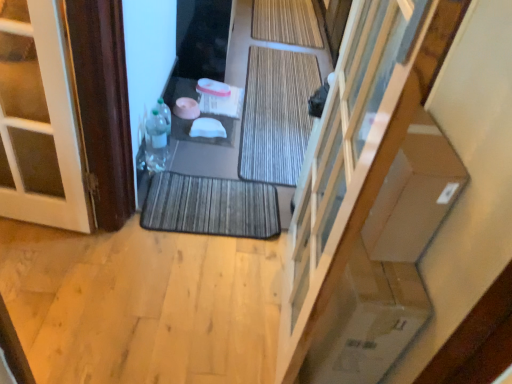
The width and height of the screenshot is (512, 384). What do you see at coordinates (286, 22) in the screenshot?
I see `natural bamboo bath mat at center, marked as the 3th bath mat in a bottom-to-top arrangement` at bounding box center [286, 22].

Locate an element on the screen. The width and height of the screenshot is (512, 384). dark gray textured bath mat at center, which is the 3th bath mat in top-to-bottom order is located at coordinates (211, 206).

Measure the distance between brown textured bath mat at center, marked as the second bath mat in a top-to-bottom arrangement, and camera.

brown textured bath mat at center, marked as the second bath mat in a top-to-bottom arrangement, and camera are 7.17 feet apart.

How much space does brown textured bath mat at center, placed as the second bath mat when sorted from front to back, occupy vertically?

The height of brown textured bath mat at center, placed as the second bath mat when sorted from front to back, is 2.13 centimeters.

The image size is (512, 384). Describe the element at coordinates (164, 114) in the screenshot. I see `translucent plastic bottle at lower left, marked as the first bottle in a top-to-bottom arrangement` at that location.

At what (x,y) coordinates should I click in order to perform the action: click on natural bamboo bath mat at center, which is the 1th bath mat from back to front. Please return your answer as a coordinate pair (x, y). This screenshot has height=384, width=512. Looking at the image, I should click on (286, 22).

Is point (261, 197) closer to viewer compared to point (264, 84)?

Yes, it is in front of point (264, 84).

Identify the location of bath mat that is the 1st object above the dark gray textured bath mat at center, which ranks as the first bath mat in front-to-back order (from a real-world perspective). (276, 115).

Can you tell me how much dark gray textured bath mat at center, which ranks as the first bath mat in front-to-back order, and brown textured bath mat at center, placed as the second bath mat when sorted from front to back, differ in facing direction?

The facing directions of dark gray textured bath mat at center, which ranks as the first bath mat in front-to-back order, and brown textured bath mat at center, placed as the second bath mat when sorted from front to back, are 2.99 degrees apart.

Looking at this image, from a real-world perspective, is dark gray textured bath mat at center, which is counted as the third bath mat, starting from the back, positioned under translucent plastic bottle at lower left, marked as the first bottle in a top-to-bottom arrangement, based on gravity?

→ Correct, in the physical world, dark gray textured bath mat at center, which is counted as the third bath mat, starting from the back, is lower than translucent plastic bottle at lower left, marked as the first bottle in a top-to-bottom arrangement.

Is dark gray textured bath mat at center, which ranks as the first bath mat in front-to-back order, in front of translucent plastic bottle at lower left, marked as the first bottle in a top-to-bottom arrangement?

Yes, it is in front of translucent plastic bottle at lower left, marked as the first bottle in a top-to-bottom arrangement.

From the picture: Is dark gray textured bath mat at center, which is counted as the third bath mat, starting from the back, thinner than translucent plastic bottle at lower left, acting as the 2th bottle starting from the bottom?

Result: No.

Is dark gray textured bath mat at center, which is the 3th bath mat in top-to-bottom order, bigger or smaller than translucent plastic bottle at lower left, acting as the 2th bottle starting from the bottom?

In the image, dark gray textured bath mat at center, which is the 3th bath mat in top-to-bottom order, appears to be larger than translucent plastic bottle at lower left, acting as the 2th bottle starting from the bottom.

Identify the location of door located behind the transparent glass door at center. This screenshot has height=384, width=512. (39, 120).

From a real-world perspective, is brown wood door at left positioned above or below transparent glass door at center?

Clearly, from a real-world perspective, brown wood door at left is below transparent glass door at center.

Looking at this image, could you tell me if brown wood door at left is turned towards transparent glass door at center?

No, brown wood door at left is not aimed at transparent glass door at center.

Considering the positions of objects natural bamboo bath mat at center, which is the 1th bath mat from back to front, and brown textured bath mat at center, marked as the second bath mat in a top-to-bottom arrangement, in the image provided, who is more to the right, natural bamboo bath mat at center, which is the 1th bath mat from back to front, or brown textured bath mat at center, marked as the second bath mat in a top-to-bottom arrangement,?

Positioned to the right is natural bamboo bath mat at center, which is the 1th bath mat from back to front.

From a real-world perspective, is natural bamboo bath mat at center, marked as the 3th bath mat in a bottom-to-top arrangement, positioned above or below brown textured bath mat at center, the 2th bath mat viewed from the back?

natural bamboo bath mat at center, marked as the 3th bath mat in a bottom-to-top arrangement, is situated higher than brown textured bath mat at center, the 2th bath mat viewed from the back, in the real world.

Is natural bamboo bath mat at center, placed as the third bath mat when sorted from front to back, facing away from brown textured bath mat at center, the 2th bath mat viewed from the back?

No.

Is natural bamboo bath mat at center, marked as the 3th bath mat in a bottom-to-top arrangement, in contact with brown textured bath mat at center, the 2th bath mat ordered from the bottom?

natural bamboo bath mat at center, marked as the 3th bath mat in a bottom-to-top arrangement, is not next to brown textured bath mat at center, the 2th bath mat ordered from the bottom, and they're not touching.

Who is shorter, translucent plastic bottle at left, which is counted as the second bottle, starting from the top, or brown textured bath mat at center, marked as the second bath mat in a top-to-bottom arrangement?

brown textured bath mat at center, marked as the second bath mat in a top-to-bottom arrangement, is shorter.

Is translucent plastic bottle at left, which is the 1th bottle from bottom to top, aimed at brown textured bath mat at center, the 2th bath mat ordered from the bottom?

No, translucent plastic bottle at left, which is the 1th bottle from bottom to top, is not aimed at brown textured bath mat at center, the 2th bath mat ordered from the bottom.

Does translucent plastic bottle at left, which is counted as the second bottle, starting from the top, have a greater width compared to brown textured bath mat at center, the 2th bath mat viewed from the back?

No, translucent plastic bottle at left, which is counted as the second bottle, starting from the top, is not wider than brown textured bath mat at center, the 2th bath mat viewed from the back.

Is translucent plastic bottle at left, which is the 1th bottle from bottom to top, positioned in front of brown textured bath mat at center, placed as the second bath mat when sorted from front to back?

Yes, translucent plastic bottle at left, which is the 1th bottle from bottom to top, is in front of brown textured bath mat at center, placed as the second bath mat when sorted from front to back.

From a real-world perspective, between translucent plastic bottle at lower left, marked as the first bottle in a top-to-bottom arrangement, and brown wood door at left, who is vertically lower?

translucent plastic bottle at lower left, marked as the first bottle in a top-to-bottom arrangement, from a real-world perspective.

How many degrees apart are the facing directions of translucent plastic bottle at lower left, marked as the first bottle in a top-to-bottom arrangement, and brown wood door at left?

They differ by 176 degrees in their facing directions.

Is translucent plastic bottle at lower left, marked as the first bottle in a top-to-bottom arrangement, facing towards brown wood door at left?

No, translucent plastic bottle at lower left, marked as the first bottle in a top-to-bottom arrangement, is not oriented towards brown wood door at left.

Looking at this image, in terms of width, does translucent plastic bottle at lower left, marked as the first bottle in a top-to-bottom arrangement, look wider or thinner when compared to brown wood door at left?

translucent plastic bottle at lower left, marked as the first bottle in a top-to-bottom arrangement, is thinner than brown wood door at left.

From a real-world perspective, is translucent plastic bottle at lower left, marked as the first bottle in a top-to-bottom arrangement, on dark gray textured bath mat at center, which is counted as the third bath mat, starting from the back?

Yes, from a real-world perspective, translucent plastic bottle at lower left, marked as the first bottle in a top-to-bottom arrangement, is above dark gray textured bath mat at center, which is counted as the third bath mat, starting from the back.

Is dark gray textured bath mat at center, which is the 3th bath mat in top-to-bottom order, located within translucent plastic bottle at lower left, marked as the first bottle in a top-to-bottom arrangement?

That's incorrect, dark gray textured bath mat at center, which is the 3th bath mat in top-to-bottom order, is not inside translucent plastic bottle at lower left, marked as the first bottle in a top-to-bottom arrangement.

Is point (168, 136) closer or farther from the camera than point (212, 205)?

Point (168, 136) is positioned farther from the camera compared to point (212, 205).

Between translucent plastic bottle at lower left, acting as the 2th bottle starting from the bottom, and dark gray textured bath mat at center, which appears as the first bath mat when ordered from the bottom, which one has more height?

translucent plastic bottle at lower left, acting as the 2th bottle starting from the bottom, is taller.

The image size is (512, 384). In order to click on bath mat lying in front of the brown textured bath mat at center, the 2th bath mat ordered from the bottom in this screenshot , I will do `click(211, 206)`.

Locate an element on the screen. The width and height of the screenshot is (512, 384). the 2nd bottle positioned above the dark gray textured bath mat at center, which is the 3th bath mat in top-to-bottom order (from a real-world perspective) is located at coordinates (164, 114).

Based on their spatial positions, is brown wood door at left or natural bamboo bath mat at center, placed as the third bath mat when sorted from front to back, further from dark gray textured bath mat at center, which is the 3th bath mat in top-to-bottom order?

Among the two, natural bamboo bath mat at center, placed as the third bath mat when sorted from front to back, is located further to dark gray textured bath mat at center, which is the 3th bath mat in top-to-bottom order.

Which object lies further to the anchor point natural bamboo bath mat at center, marked as the 3th bath mat in a bottom-to-top arrangement, brown wood door at left or transparent glass door at center?

The object further to natural bamboo bath mat at center, marked as the 3th bath mat in a bottom-to-top arrangement, is transparent glass door at center.

Which object lies nearer to the anchor point natural bamboo bath mat at center, the first bath mat in the top-to-bottom sequence, transparent glass door at center or translucent plastic bottle at left, which is counted as the second bottle, starting from the top?

translucent plastic bottle at left, which is counted as the second bottle, starting from the top, is closer to natural bamboo bath mat at center, the first bath mat in the top-to-bottom sequence.

When comparing their distances from brown wood door at left, does natural bamboo bath mat at center, the first bath mat in the top-to-bottom sequence, or translucent plastic bottle at lower left, marked as the first bottle in a top-to-bottom arrangement, seem closer?

translucent plastic bottle at lower left, marked as the first bottle in a top-to-bottom arrangement, lies closer to brown wood door at left than the other object.

Considering their positions, is transparent glass door at center positioned closer to dark gray textured bath mat at center, which is counted as the third bath mat, starting from the back, than brown textured bath mat at center, placed as the second bath mat when sorted from front to back?

Among the two, brown textured bath mat at center, placed as the second bath mat when sorted from front to back, is located nearer to dark gray textured bath mat at center, which is counted as the third bath mat, starting from the back.

From the image, which object appears to be nearer to translucent plastic bottle at lower left, acting as the 2th bottle starting from the bottom, transparent glass door at center or brown textured bath mat at center, placed as the second bath mat when sorted from front to back?

brown textured bath mat at center, placed as the second bath mat when sorted from front to back, lies closer to translucent plastic bottle at lower left, acting as the 2th bottle starting from the bottom, than the other object.

Considering their positions, is brown textured bath mat at center, the 2th bath mat viewed from the back, positioned further to translucent plastic bottle at lower left, acting as the 2th bottle starting from the bottom, than dark gray textured bath mat at center, which appears as the first bath mat when ordered from the bottom?

brown textured bath mat at center, the 2th bath mat viewed from the back, is further to translucent plastic bottle at lower left, acting as the 2th bottle starting from the bottom.

From the image, which object appears to be farther from natural bamboo bath mat at center, the first bath mat in the top-to-bottom sequence, brown wood door at left or translucent plastic bottle at lower left, acting as the 2th bottle starting from the bottom?

brown wood door at left lies further to natural bamboo bath mat at center, the first bath mat in the top-to-bottom sequence, than the other object.

Image resolution: width=512 pixels, height=384 pixels. Identify the location of bath mat positioned between translucent plastic bottle at left, which is the 1th bottle from bottom to top, and natural bamboo bath mat at center, placed as the third bath mat when sorted from front to back, from near to far. (276, 115).

This screenshot has height=384, width=512. In order to click on bath mat located between brown wood door at left and transparent glass door at center in the left-right direction in this screenshot , I will do `click(211, 206)`.

Find the location of a particular element. Image resolution: width=512 pixels, height=384 pixels. bottle between translucent plastic bottle at lower left, acting as the 2th bottle starting from the bottom, and dark gray textured bath mat at center, which ranks as the first bath mat in front-to-back order, vertically is located at coordinates (156, 141).

Image resolution: width=512 pixels, height=384 pixels. I want to click on door between transparent glass door at center and natural bamboo bath mat at center, the first bath mat in the top-to-bottom sequence, from front to back, so click(39, 120).